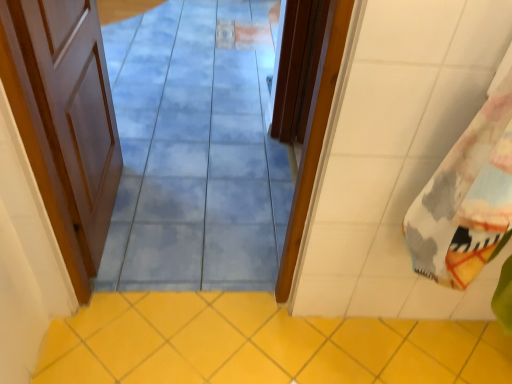
At what (x,y) coordinates should I click in order to perform the action: click on yellow ceramic tile at lower center. Please return your answer as a coordinate pair (x, y). Looking at the image, I should click on (260, 344).

This screenshot has width=512, height=384. What do you see at coordinates (70, 108) in the screenshot?
I see `white wood door at left, which is the second door in right-to-left order` at bounding box center [70, 108].

The height and width of the screenshot is (384, 512). Describe the element at coordinates (466, 198) in the screenshot. I see `printed cotton beach towel at right` at that location.

This screenshot has width=512, height=384. In order to click on yellow ceramic tile at lower center in this screenshot , I will do `click(260, 344)`.

From the image's perspective, which is below, wooden door at center, positioned as the second door in left-to-right order, or blue glossy tile at center?

blue glossy tile at center appears lower in the image.

From a real-world perspective, between wooden door at center, the first door viewed from the right, and blue glossy tile at center, who is vertically higher?

From a 3D spatial view, blue glossy tile at center is above.

Can you see wooden door at center, the first door viewed from the right, touching blue glossy tile at center?

wooden door at center, the first door viewed from the right, and blue glossy tile at center are not in contact.

Which object is thinner, wooden door at center, positioned as the second door in left-to-right order, or blue glossy tile at center?

blue glossy tile at center.

From a real-world perspective, who is located higher, yellow ceramic tile at lower center or wooden door at center, the first door viewed from the right?

wooden door at center, the first door viewed from the right, is physically above.

From the image's perspective, would you say yellow ceramic tile at lower center is shown under wooden door at center, positioned as the second door in left-to-right order?

Yes, from the image's perspective, yellow ceramic tile at lower center is beneath wooden door at center, positioned as the second door in left-to-right order.

Who is more distant, yellow ceramic tile at lower center or wooden door at center, the first door viewed from the right?

yellow ceramic tile at lower center is further from the camera.

Consider the image. How many degrees apart are the facing directions of yellow ceramic tile at lower center and wooden door at center, the first door viewed from the right?

yellow ceramic tile at lower center and wooden door at center, the first door viewed from the right, are facing 90.3 degrees away from each other.

Based on the photo, from the image's perspective, between yellow ceramic tile at lower center and printed cotton beach towel at right, who is located below?

yellow ceramic tile at lower center.

In terms of size, does yellow ceramic tile at lower center appear bigger or smaller than printed cotton beach towel at right?

Considering their sizes, yellow ceramic tile at lower center takes up less space than printed cotton beach towel at right.

In the image, is yellow ceramic tile at lower center positioned in front of or behind printed cotton beach towel at right?

Visually, yellow ceramic tile at lower center is located behind printed cotton beach towel at right.

Is printed cotton beach towel at right surrounded by yellow ceramic tile at lower center?

No, printed cotton beach towel at right is not surrounded by yellow ceramic tile at lower center.

Is wooden door at center, the first door viewed from the right, next to white wood door at left, the 1th door viewed from the left, and touching it?

No, wooden door at center, the first door viewed from the right, is not touching white wood door at left, the 1th door viewed from the left.

From a real-world perspective, who is located higher, wooden door at center, positioned as the second door in left-to-right order, or white wood door at left, which is the second door in right-to-left order?

white wood door at left, which is the second door in right-to-left order.

Identify the location of door in front of the wooden door at center, the first door viewed from the right. (70, 108).

Considering their positions, is wooden door at center, the first door viewed from the right, located in front of or behind white wood door at left, the 1th door viewed from the left?

wooden door at center, the first door viewed from the right, is positioned farther from the viewer than white wood door at left, the 1th door viewed from the left.

From a real-world perspective, is printed cotton beach towel at right on top of yellow ceramic tile at lower center?

Yes, from a real-world perspective, printed cotton beach towel at right is over yellow ceramic tile at lower center

How many degrees apart are the facing directions of printed cotton beach towel at right and yellow ceramic tile at lower center?

The angular difference between printed cotton beach towel at right and yellow ceramic tile at lower center is 178 degrees.

Which is more to the right, printed cotton beach towel at right or yellow ceramic tile at lower center?

printed cotton beach towel at right.

Looking at this image, considering the sizes of printed cotton beach towel at right and yellow ceramic tile at lower center in the image, is printed cotton beach towel at right bigger or smaller than yellow ceramic tile at lower center?

In the image, printed cotton beach towel at right appears to be larger than yellow ceramic tile at lower center.

At what (x,y) coordinates should I click in order to perform the action: click on beach towel located below the blue glossy tile at center (from the image's perspective). Please return your answer as a coordinate pair (x, y). Looking at the image, I should click on (466, 198).

Is printed cotton beach towel at right situated inside blue glossy tile at center or outside?

The correct answer is: outside.

Considering the relative sizes of printed cotton beach towel at right and blue glossy tile at center in the image provided, is printed cotton beach towel at right bigger than blue glossy tile at center?

Indeed, printed cotton beach towel at right has a larger size compared to blue glossy tile at center.

From the picture: Considering the sizes of printed cotton beach towel at right and blue glossy tile at center in the image, is printed cotton beach towel at right wider or thinner than blue glossy tile at center?

printed cotton beach towel at right is wider than blue glossy tile at center.

In the scene shown: Looking at their sizes, would you say printed cotton beach towel at right is wider or thinner than white wood door at left, the 1th door viewed from the left?

In the image, printed cotton beach towel at right appears to be wider than white wood door at left, the 1th door viewed from the left.

Considering the positions of points (418, 213) and (73, 56), is point (418, 213) farther from camera compared to point (73, 56)?

That is False.

Is printed cotton beach towel at right taller or shorter than white wood door at left, which is the second door in right-to-left order?

In the image, printed cotton beach towel at right appears to be shorter than white wood door at left, which is the second door in right-to-left order.

This screenshot has height=384, width=512. There is a printed cotton beach towel at right. Find the location of `the 1st door below it (from a real-world perspective)`. the 1st door below it (from a real-world perspective) is located at coordinates (70, 108).

The width and height of the screenshot is (512, 384). Find the location of `door to the right of blue glossy tile at center`. door to the right of blue glossy tile at center is located at coordinates (314, 139).

What are the coordinates of `the 2nd door above when counting from the yellow ceramic tile at lower center (from the image's perspective)` in the screenshot? It's located at (314, 139).

From the image, which object appears to be nearer to white wood door at left, which is the second door in right-to-left order, wooden door at center, the first door viewed from the right, or blue glossy tile at center?

blue glossy tile at center.

Which object lies further to the anchor point printed cotton beach towel at right, white wood door at left, the 1th door viewed from the left, or wooden door at center, the first door viewed from the right?

white wood door at left, the 1th door viewed from the left, is further to printed cotton beach towel at right.

When comparing their distances from yellow ceramic tile at lower center, does printed cotton beach towel at right or blue glossy tile at center seem further?

Based on the image, blue glossy tile at center appears to be further to yellow ceramic tile at lower center.

Estimate the real-world distances between objects in this image. Which object is further from wooden door at center, positioned as the second door in left-to-right order, yellow ceramic tile at lower center or white wood door at left, the 1th door viewed from the left?

Based on the image, white wood door at left, the 1th door viewed from the left, appears to be further to wooden door at center, positioned as the second door in left-to-right order.

When comparing their distances from yellow ceramic tile at lower center, does blue glossy tile at center or printed cotton beach towel at right seem further?

blue glossy tile at center is positioned further to the anchor yellow ceramic tile at lower center.

Looking at this image, estimate the real-world distances between objects in this image. Which object is further from wooden door at center, the first door viewed from the right, printed cotton beach towel at right or yellow ceramic tile at lower center?

Based on the image, yellow ceramic tile at lower center appears to be further to wooden door at center, the first door viewed from the right.

Which object lies nearer to the anchor point yellow ceramic tile at lower center, white wood door at left, which is the second door in right-to-left order, or printed cotton beach towel at right?

white wood door at left, which is the second door in right-to-left order, is positioned closer to the anchor yellow ceramic tile at lower center.

From the image, which object appears to be nearer to printed cotton beach towel at right, blue glossy tile at center or yellow ceramic tile at lower center?

The object closer to printed cotton beach towel at right is yellow ceramic tile at lower center.

At what (x,y) coordinates should I click in order to perform the action: click on beach towel between wooden door at center, positioned as the second door in left-to-right order, and yellow ceramic tile at lower center in the up-down direction. Please return your answer as a coordinate pair (x, y). The width and height of the screenshot is (512, 384). Looking at the image, I should click on (466, 198).

Find the location of `door between white wood door at left, the 1th door viewed from the left, and printed cotton beach towel at right, in the horizontal direction`. door between white wood door at left, the 1th door viewed from the left, and printed cotton beach towel at right, in the horizontal direction is located at coordinates 314,139.

At what (x,y) coordinates should I click in order to perform the action: click on path that lies between wooden door at center, the first door viewed from the right, and yellow ceramic tile at lower center from top to bottom. Please return your answer as a coordinate pair (x, y). Looking at the image, I should click on (193, 155).

At what (x,y) coordinates should I click in order to perform the action: click on ceramic tile located between white wood door at left, which is the second door in right-to-left order, and printed cotton beach towel at right in the left-right direction. Please return your answer as a coordinate pair (x, y). This screenshot has width=512, height=384. Looking at the image, I should click on (260, 344).